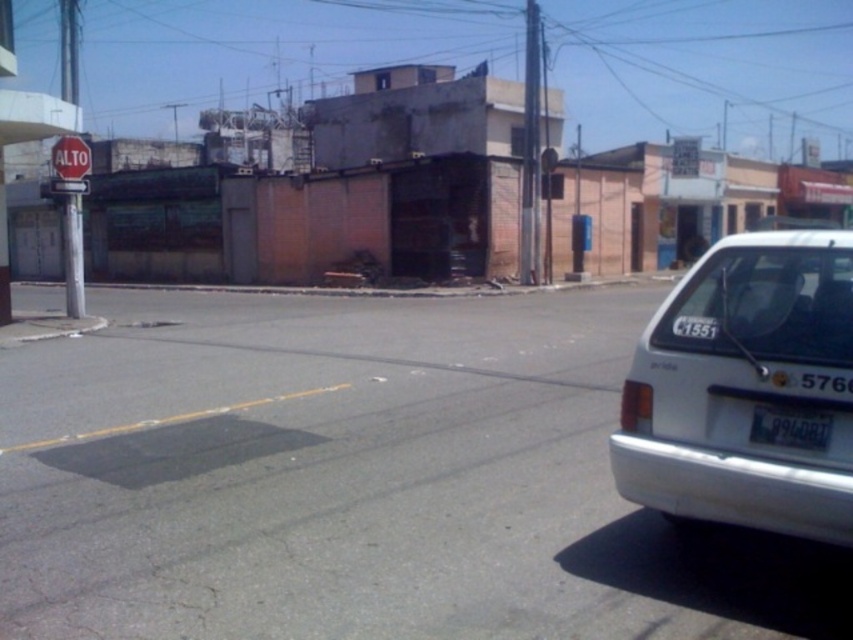
Does black plastic license plate at lower right appear on the right side of white plastic sign at upper left?

Correct, you'll find black plastic license plate at lower right to the right of white plastic sign at upper left.

Between point (752, 442) and point (71, 193), which one is positioned in front?

Point (752, 442) is more forward.

The width and height of the screenshot is (853, 640). In order to click on black plastic license plate at lower right in this screenshot , I will do `click(790, 428)`.

The image size is (853, 640). What do you see at coordinates (747, 388) in the screenshot? I see `white matte sedan at right` at bounding box center [747, 388].

Does white matte sedan at right have a larger size compared to white plastic sign at upper left?

Correct, white matte sedan at right is larger in size than white plastic sign at upper left.

Is point (718, 250) positioned before point (82, 184)?

Yes, it is.

In order to click on white matte sedan at right in this screenshot , I will do `click(747, 388)`.

Who is shorter, black plastic license plate at lower right or red matte stop sign at upper left?

black plastic license plate at lower right

Which is more to the right, black plastic license plate at lower right or red matte stop sign at upper left?

From the viewer's perspective, black plastic license plate at lower right appears more on the right side.

Is point (793, 428) positioned in front of point (71, 141)?

Yes, it is.

Locate an element on the screen. The height and width of the screenshot is (640, 853). black plastic license plate at lower right is located at coordinates (790, 428).